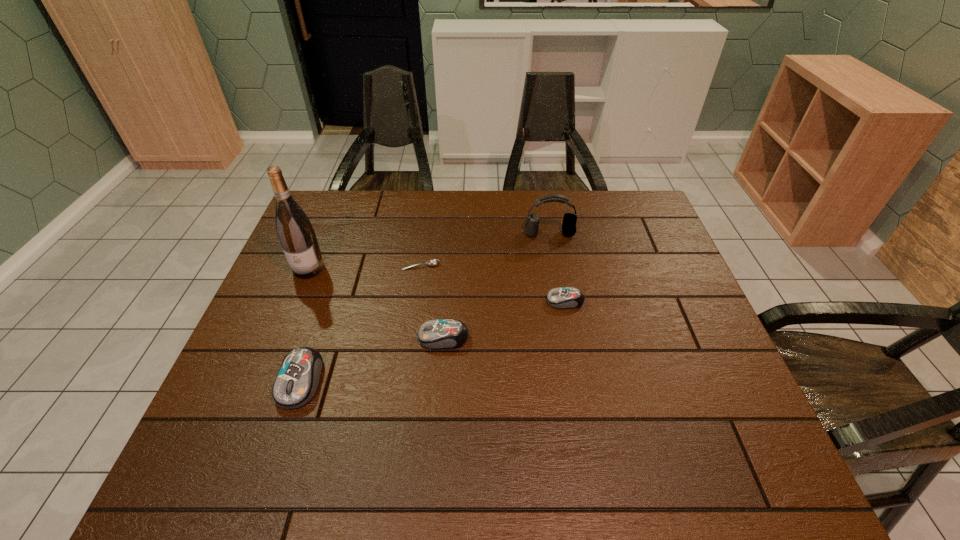
Find the location of a particular element. This screenshot has height=540, width=960. the nearest object is located at coordinates (297, 381).

This screenshot has height=540, width=960. In order to click on the tallest computer mouse in this screenshot , I will do `click(297, 381)`.

Find the location of a particular element. This screenshot has width=960, height=540. the second shortest computer mouse is located at coordinates (438, 333).

Identify the location of the second computer mouse from left to right. (438, 333).

Where is `the fourth farthest object`? the fourth farthest object is located at coordinates (563, 297).

Locate an element on the screen. This screenshot has width=960, height=540. the farthest computer mouse is located at coordinates (563, 297).

Where is `the tallest object`? The height and width of the screenshot is (540, 960). the tallest object is located at coordinates (296, 234).

The image size is (960, 540). Identify the location of the shortest object. (432, 262).

The image size is (960, 540). I want to click on the farthest object, so click(x=569, y=220).

The image size is (960, 540). In order to click on the second tallest object in this screenshot , I will do `click(569, 220)`.